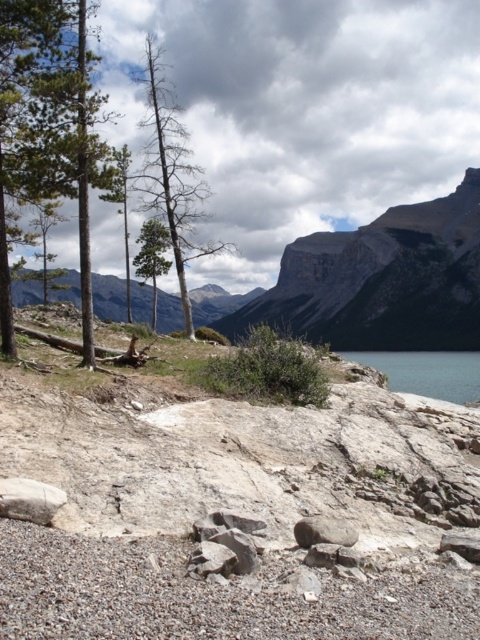
You are a hiker trying to navigate through the rocky terrain. You notice a green matte tree at center and a gray rock at center. Which object would you choose to step on for a more stable footing?

The green matte tree at center is bigger than the gray rock at center, so stepping on the green matte tree at center would provide a more stable footing due to its larger size.

Consider the image. You are a photographer standing in the rugged landscape and want to take a photo that includes both the point at coordinates (91, 61) and the point at coordinates (355, 538). Based on their positions, which point will appear closer to the camera in your photo?

Point at coordinates (91, 61) will appear closer to the camera in the photo because it is further to the camera than point at coordinates (355, 538).

Looking at this image, you are a hiker trying to navigate through the rocky terrain. You see the rugged stone mountain at upper center and the green pine tree at left. Which object is positioned to the right of the other?

The rugged stone mountain at upper center is to the right of the green pine tree at left.